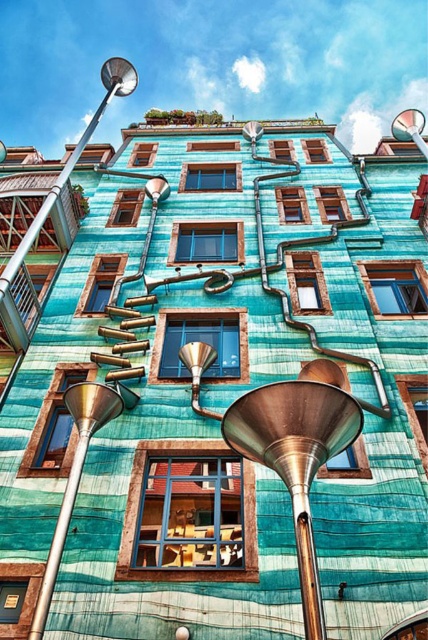
Question: Is metallic teal funnel at center smaller than brass/bronze funnel at center?

Choices:
 (A) no
 (B) yes

Answer: (A)

Question: Which object appears closest to the camera in this image?

Choices:
 (A) metallic teal funnel at center
 (B) brass/bronze funnel at center

Answer: (A)

Question: Based on their relative distances, which object is nearer to the brass/bronze funnel at center?

Choices:
 (A) satin gold funnel at lower left
 (B) metallic teal funnel at center

Answer: (B)

Question: Which object is the farthest from the metallic teal funnel at center?

Choices:
 (A) brass/bronze funnel at center
 (B) satin gold funnel at lower left

Answer: (B)

Question: In this image, where is metallic teal funnel at center located relative to satin gold funnel at lower left?

Choices:
 (A) left
 (B) right

Answer: (B)

Question: Can you confirm if satin gold funnel at lower left is positioned above brass/bronze funnel at center?

Choices:
 (A) no
 (B) yes

Answer: (A)